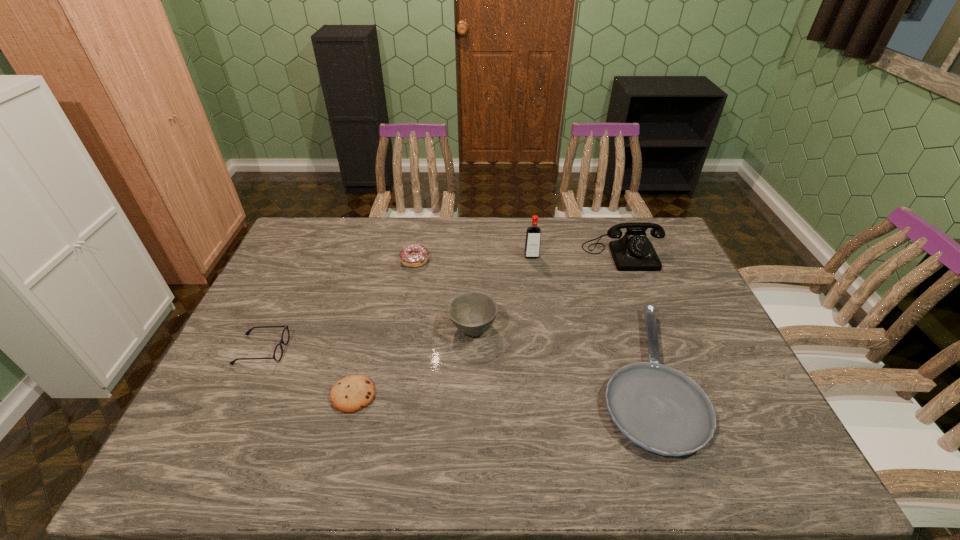
Where is `the tallest object`? The image size is (960, 540). the tallest object is located at coordinates (533, 233).

I want to click on the third object from right to left, so click(533, 233).

Find the location of a particular element. The width and height of the screenshot is (960, 540). telephone is located at coordinates (633, 252).

At what (x,y) coordinates should I click in order to perform the action: click on the fourth object from left to right. Please return your answer as a coordinate pair (x, y). This screenshot has width=960, height=540. Looking at the image, I should click on (472, 313).

Identify the location of bowl. (472, 313).

Where is `doughnut`? This screenshot has height=540, width=960. doughnut is located at coordinates (416, 255).

The width and height of the screenshot is (960, 540). Find the location of `spectacles`. spectacles is located at coordinates (278, 352).

You are a GUI agent. You are given a task and a screenshot of the screen. Output one action in this format:
    pyautogui.click(x=<x>, y=<y>)
    Task: Click on the frying pan
    
    Given the screenshot: What is the action you would take?
    pyautogui.click(x=659, y=408)

Locate an element on the screen. the shortest object is located at coordinates (352, 393).

What are the coordinates of `free space located on the front and back of the tallest object` in the screenshot? It's located at (534, 273).